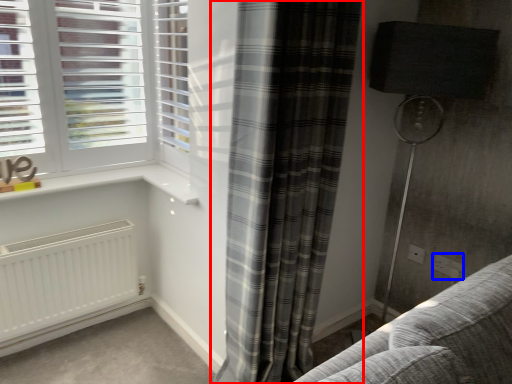
Question: Which object is closer to the camera taking this photo, curtain (highlighted by a red box) or electric outlet (highlighted by a blue box)?

Choices:
 (A) curtain
 (B) electric outlet

Answer: (A)